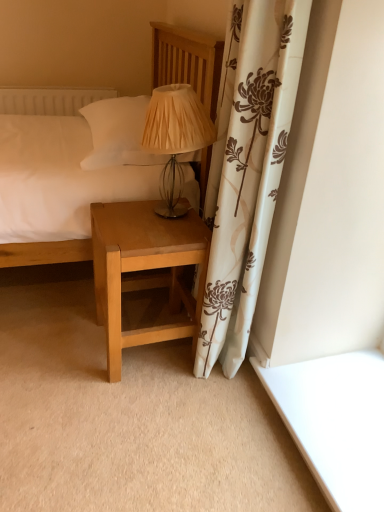
Question: Can you confirm if light brown wood nightstand at lower center is shorter than matte beige fabric lampshade at center?

Choices:
 (A) yes
 (B) no

Answer: (B)

Question: Considering the relative sizes of light brown wood nightstand at lower center and matte beige fabric lampshade at center in the image provided, is light brown wood nightstand at lower center taller than matte beige fabric lampshade at center?

Choices:
 (A) no
 (B) yes

Answer: (B)

Question: Is light brown wood nightstand at lower center positioned in front of matte beige fabric lampshade at center?

Choices:
 (A) yes
 (B) no

Answer: (B)

Question: Is light brown wood nightstand at lower center positioned with its back to matte beige fabric lampshade at center?

Choices:
 (A) yes
 (B) no

Answer: (B)

Question: Can you confirm if light brown wood nightstand at lower center is thinner than matte beige fabric lampshade at center?

Choices:
 (A) no
 (B) yes

Answer: (A)

Question: In terms of width, does matte beige fabric lampshade at center look wider or thinner when compared to matte wood bed at center?

Choices:
 (A) thin
 (B) wide

Answer: (A)

Question: In terms of height, does matte beige fabric lampshade at center look taller or shorter compared to matte wood bed at center?

Choices:
 (A) short
 (B) tall

Answer: (A)

Question: Looking at the image, does matte beige fabric lampshade at center seem bigger or smaller compared to matte wood bed at center?

Choices:
 (A) small
 (B) big

Answer: (A)

Question: From the image's perspective, relative to matte wood bed at center, is matte beige fabric lampshade at center above or below?

Choices:
 (A) below
 (B) above

Answer: (A)

Question: Is light brown wood nightstand at lower center taller or shorter than matte wood bed at center?

Choices:
 (A) short
 (B) tall

Answer: (A)

Question: From the image's perspective, is light brown wood nightstand at lower center located above or below matte wood bed at center?

Choices:
 (A) below
 (B) above

Answer: (A)

Question: Relative to matte wood bed at center, is light brown wood nightstand at lower center in front or behind?

Choices:
 (A) behind
 (B) front

Answer: (A)

Question: From a real-world perspective, is light brown wood nightstand at lower center physically located above or below matte wood bed at center?

Choices:
 (A) below
 (B) above

Answer: (A)

Question: From the image's perspective, is matte beige fabric lampshade at center located above or below light brown wood nightstand at lower center?

Choices:
 (A) below
 (B) above

Answer: (B)

Question: Considering the positions of matte beige fabric lampshade at center and light brown wood nightstand at lower center in the image, is matte beige fabric lampshade at center bigger or smaller than light brown wood nightstand at lower center?

Choices:
 (A) small
 (B) big

Answer: (A)